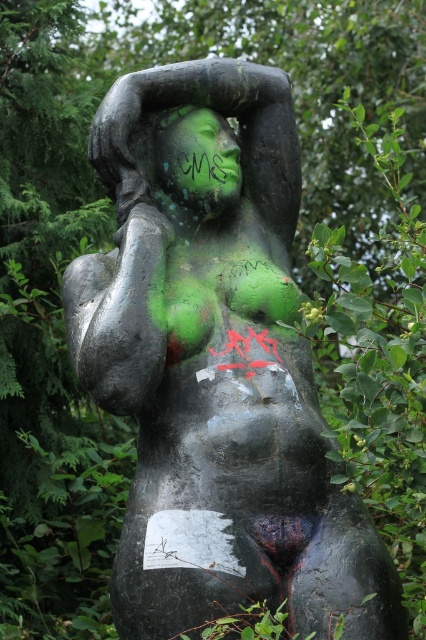
Is matte black statue at center positioned in front of green matte face at center?

Yes, matte black statue at center is closer to the viewer.

Is matte black statue at center bigger than green matte face at center?

Correct, matte black statue at center is larger in size than green matte face at center.

What do you see at coordinates (218, 374) in the screenshot? I see `matte black statue at center` at bounding box center [218, 374].

Locate an element on the screen. This screenshot has width=426, height=640. matte black statue at center is located at coordinates (218, 374).